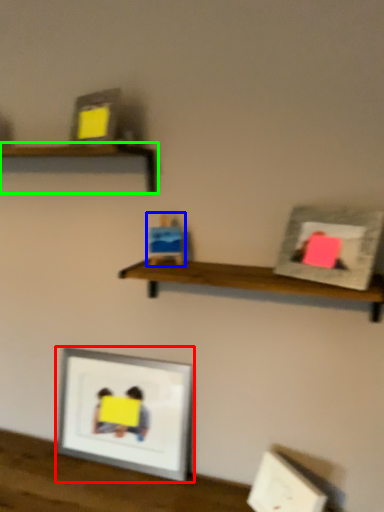
Question: Which object is positioned farthest from picture frame (highlighted by a red box)? Select from toy (highlighted by a blue box) and shelf (highlighted by a green box).

Choices:
 (A) toy
 (B) shelf

Answer: (B)